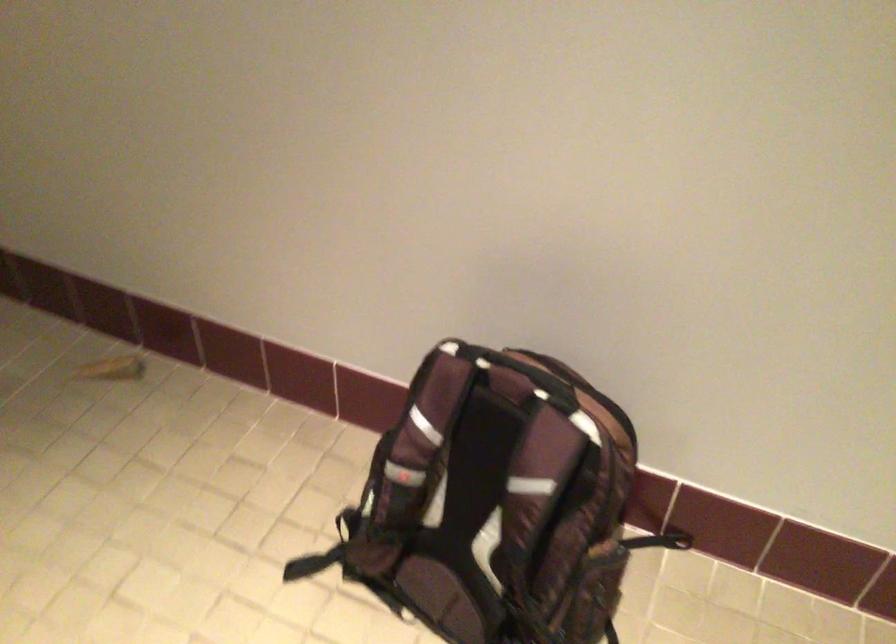
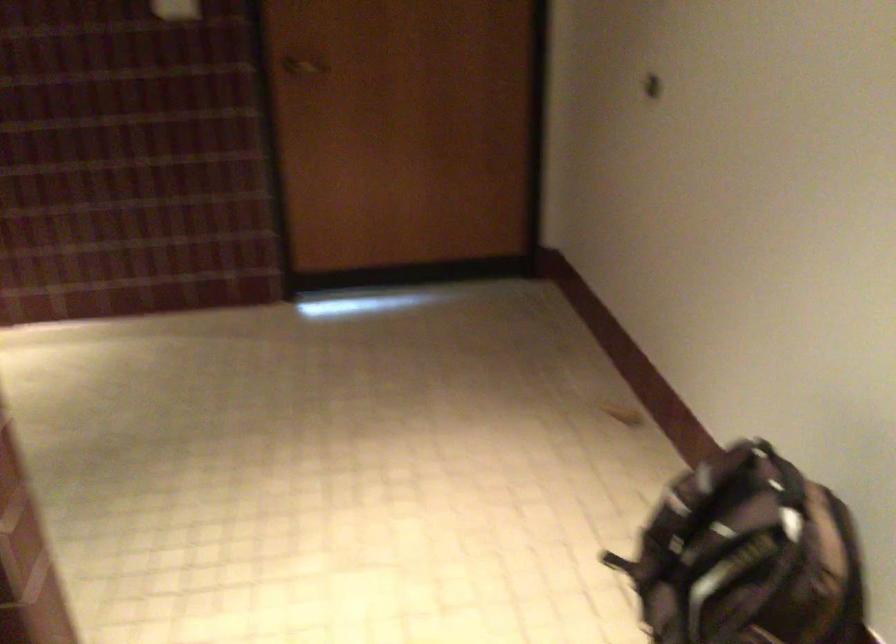
Where in the second image is the point corresponding to (528,487) from the first image?

(748, 556)